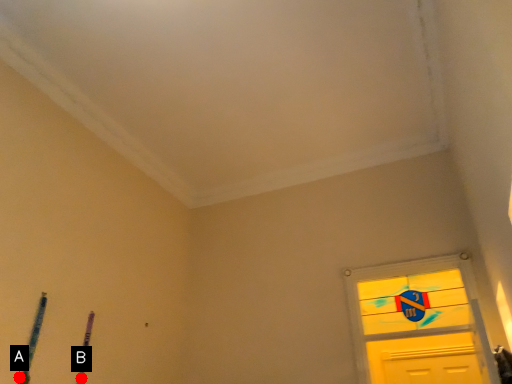
Question: Two points are circled on the image, labeled by A and B beside each circle. Which point appears closest to the camera in this image?

Choices:
 (A) A is closer
 (B) B is closer

Answer: (A)